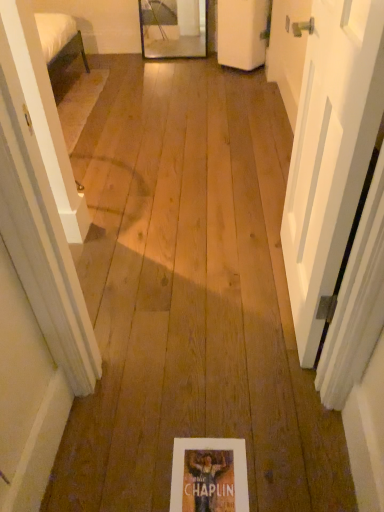
Identify the location of matte paper flyer at center. The width and height of the screenshot is (384, 512). (209, 475).

Identify the location of white matte door at right, acting as the second door starting from the back. click(x=330, y=155).

From the picture: Is matte paper flyer at center located outside white matte door at upper center, the second door ordered from the bottom?

Yes, matte paper flyer at center is not within white matte door at upper center, the second door ordered from the bottom.

Is matte paper flyer at center oriented towards white matte door at upper center, the second door in the front-to-back sequence?

No, matte paper flyer at center is not aimed at white matte door at upper center, the second door in the front-to-back sequence.

From the image's perspective, is matte paper flyer at center located beneath white matte door at upper center, acting as the 1th door starting from the top?

Yes.

This screenshot has height=512, width=384. I want to click on flyer below the white matte door at upper center, acting as the 1th door starting from the top (from the image's perspective), so click(209, 475).

Which of these two, white matte door at upper center, the second door ordered from the bottom, or white matte door at right, acting as the second door starting from the back, is wider?

white matte door at upper center, the second door ordered from the bottom.

Is white matte door at upper center, which is counted as the 1th door, starting from the back, looking in the opposite direction of white matte door at right, acting as the second door starting from the back?

That's not correct — white matte door at upper center, which is counted as the 1th door, starting from the back, is not looking away from white matte door at right, acting as the second door starting from the back.

Between white matte door at upper center, the second door in the front-to-back sequence, and white matte door at right, which appears as the first door when viewed from the front, which one has less height?

With less height is white matte door at upper center, the second door in the front-to-back sequence.

Which of these two, white matte door at right, acting as the second door starting from the back, or matte paper flyer at center, is thinner?

Thinner between the two is white matte door at right, acting as the second door starting from the back.

Considering the relative positions of white matte door at right, placed as the second door when sorted from top to bottom, and matte paper flyer at center in the image provided, is white matte door at right, placed as the second door when sorted from top to bottom, to the right of matte paper flyer at center from the viewer's perspective?

Correct, you'll find white matte door at right, placed as the second door when sorted from top to bottom, to the right of matte paper flyer at center.

Choose the correct answer: Is white matte door at right, which appears as the 1th door when ordered from the bottom, inside matte paper flyer at center or outside it?

white matte door at right, which appears as the 1th door when ordered from the bottom, is spatially situated outside matte paper flyer at center.

Is white matte door at right, which appears as the 1th door when ordered from the bottom, next to white matte door at upper center, which is counted as the 1th door, starting from the back?

No, white matte door at right, which appears as the 1th door when ordered from the bottom, is not in contact with white matte door at upper center, which is counted as the 1th door, starting from the back.

Considering the relative sizes of white matte door at right, which appears as the first door when viewed from the front, and white matte door at upper center, the second door ordered from the bottom, in the image provided, is white matte door at right, which appears as the first door when viewed from the front, shorter than white matte door at upper center, the second door ordered from the bottom,?

No.

Considering the positions of point (303, 135) and point (257, 33), is point (303, 135) closer or farther from the camera than point (257, 33)?

Point (303, 135) appears to be closer to the viewer than point (257, 33).

Considering the positions of objects white matte door at right, which appears as the first door when viewed from the front, and white matte door at upper center, which is counted as the 1th door, starting from the back, in the image provided, who is more to the right, white matte door at right, which appears as the first door when viewed from the front, or white matte door at upper center, which is counted as the 1th door, starting from the back,?

Positioned to the right is white matte door at upper center, which is counted as the 1th door, starting from the back.

Is matte paper flyer at center not close to white matte door at right, placed as the second door when sorted from top to bottom?

That's not correct — matte paper flyer at center is a little close to white matte door at right, placed as the second door when sorted from top to bottom.

Would you say matte paper flyer at center is outside white matte door at right, which appears as the first door when viewed from the front?

Yes, matte paper flyer at center is outside of white matte door at right, which appears as the first door when viewed from the front.

Is matte paper flyer at center to the right of white matte door at right, placed as the second door when sorted from top to bottom, from the viewer's perspective?

No, matte paper flyer at center is not to the right of white matte door at right, placed as the second door when sorted from top to bottom.

In the image, is matte paper flyer at center positioned in front of or behind white matte door at right, acting as the second door starting from the back?

Clearly, matte paper flyer at center is behind white matte door at right, acting as the second door starting from the back.

Between white matte door at upper center, which is counted as the 1th door, starting from the back, and matte paper flyer at center, which one appears on the right side from the viewer's perspective?

white matte door at upper center, which is counted as the 1th door, starting from the back, is more to the right.

How many degrees apart are the facing directions of white matte door at upper center, acting as the 1th door starting from the top, and matte paper flyer at center?

The facing directions of white matte door at upper center, acting as the 1th door starting from the top, and matte paper flyer at center are 90.5 degrees apart.

Is white matte door at upper center, which is counted as the 1th door, starting from the back, looking in the opposite direction of matte paper flyer at center?

white matte door at upper center, which is counted as the 1th door, starting from the back, does not have its back to matte paper flyer at center.

Identify the location of the 1st door positioned above the matte paper flyer at center (from a real-world perspective). (242, 33).

Where is `door behind the white matte door at right, acting as the second door starting from the back`? door behind the white matte door at right, acting as the second door starting from the back is located at coordinates (242, 33).

From the image, which object appears to be nearer to white matte door at right, placed as the second door when sorted from top to bottom, white matte door at upper center, acting as the 1th door starting from the top, or matte paper flyer at center?

The object closer to white matte door at right, placed as the second door when sorted from top to bottom, is matte paper flyer at center.

Considering their positions, is matte paper flyer at center positioned closer to white matte door at upper center, the second door ordered from the bottom, than white matte door at right, placed as the second door when sorted from top to bottom?

Based on the image, white matte door at right, placed as the second door when sorted from top to bottom, appears to be nearer to white matte door at upper center, the second door ordered from the bottom.

Based on their spatial positions, is white matte door at right, placed as the second door when sorted from top to bottom, or white matte door at upper center, the second door in the front-to-back sequence, further from matte paper flyer at center?

white matte door at upper center, the second door in the front-to-back sequence, lies further to matte paper flyer at center than the other object.

Considering their positions, is white matte door at upper center, the second door ordered from the bottom, positioned further to matte paper flyer at center than white matte door at right, acting as the second door starting from the back?

Based on the image, white matte door at upper center, the second door ordered from the bottom, appears to be further to matte paper flyer at center.

Considering their positions, is matte paper flyer at center positioned closer to white matte door at right, which appears as the first door when viewed from the front, than white matte door at upper center, the second door in the front-to-back sequence?

matte paper flyer at center is closer to white matte door at right, which appears as the first door when viewed from the front.

Based on their spatial positions, is white matte door at right, placed as the second door when sorted from top to bottom, or matte paper flyer at center further from white matte door at upper center, the second door ordered from the bottom?

The object further to white matte door at upper center, the second door ordered from the bottom, is matte paper flyer at center.

I want to click on flyer positioned between white matte door at right, which appears as the first door when viewed from the front, and white matte door at upper center, the second door ordered from the bottom, from near to far, so click(209, 475).